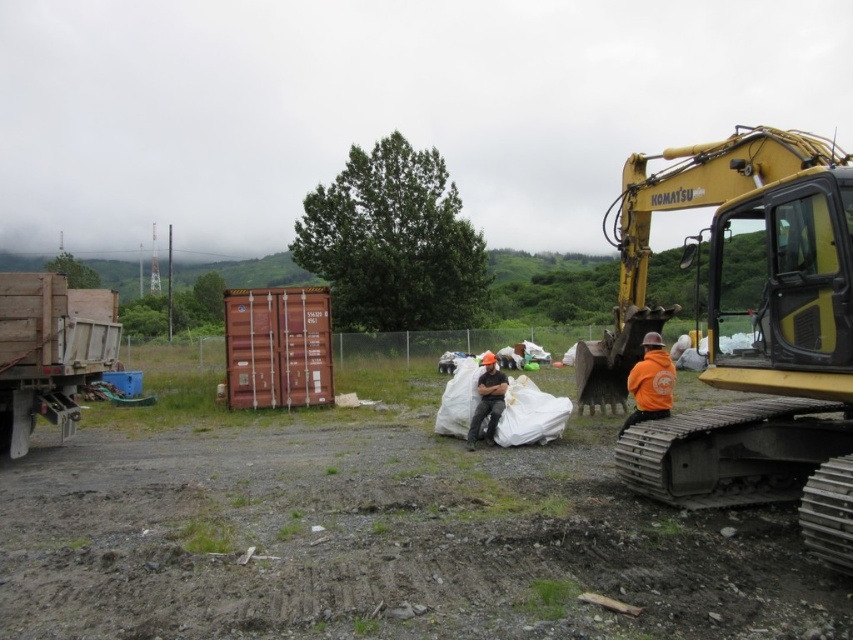
Question: Is yellow metallic excavator at right wider than wooden truck at left?

Choices:
 (A) no
 (B) yes

Answer: (B)

Question: Which of the following is the closest to the observer?

Choices:
 (A) (90, 323)
 (B) (663, 397)

Answer: (B)

Question: Which of the following is the farthest from the observer?

Choices:
 (A) orange hard hat at center
 (B) yellow metallic excavator at right
 (C) wooden truck at left
 (D) orange fleece jacket at lower right

Answer: (A)

Question: Is yellow metallic excavator at right positioned in front of wooden truck at left?

Choices:
 (A) yes
 (B) no

Answer: (A)

Question: Can you confirm if wooden truck at left is positioned to the left of orange fleece jacket at lower right?

Choices:
 (A) no
 (B) yes

Answer: (B)

Question: Which of the following is the farthest from the observer?

Choices:
 (A) wooden truck at left
 (B) orange fleece jacket at lower right
 (C) yellow metallic excavator at right
 (D) orange hard hat at center

Answer: (D)